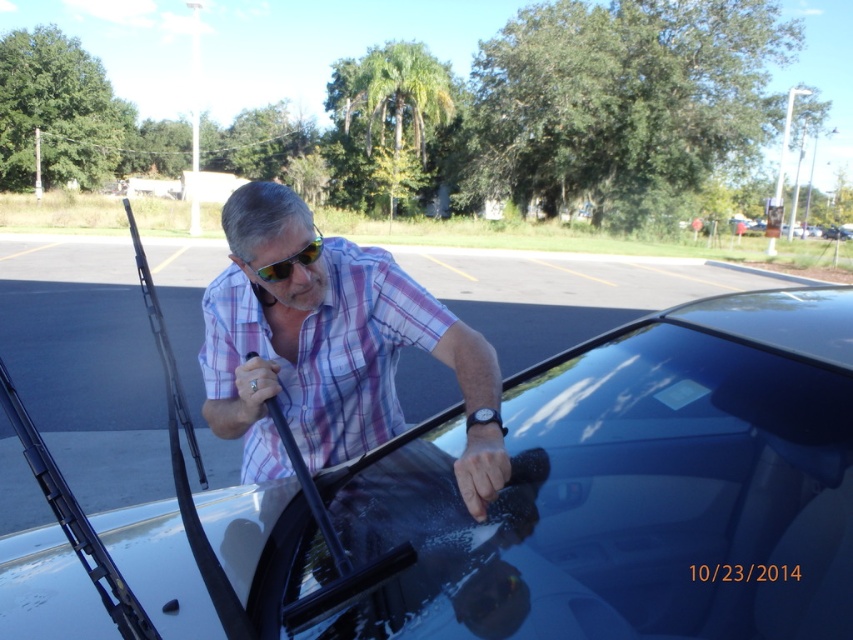
Question: Which point is farther to the camera?

Choices:
 (A) (497, 419)
 (B) (257, 250)
 (C) (73, 582)

Answer: (B)

Question: From the image, what is the correct spatial relationship of glossy white car at center in relation to yellow reflective lenses at center?

Choices:
 (A) below
 (B) above

Answer: (A)

Question: Which object is closer to the camera taking this photo?

Choices:
 (A) glossy white car at center
 (B) plaid shirt at center

Answer: (A)

Question: From the image, what is the correct spatial relationship of plaid shirt at center in relation to yellow reflective lenses at center?

Choices:
 (A) above
 (B) below

Answer: (B)

Question: Does plaid shirt at center appear on the right side of yellow reflective lenses at center?

Choices:
 (A) yes
 (B) no

Answer: (A)

Question: Which point is farther to the camera?

Choices:
 (A) (221, 540)
 (B) (416, 321)
 (C) (267, 280)

Answer: (B)